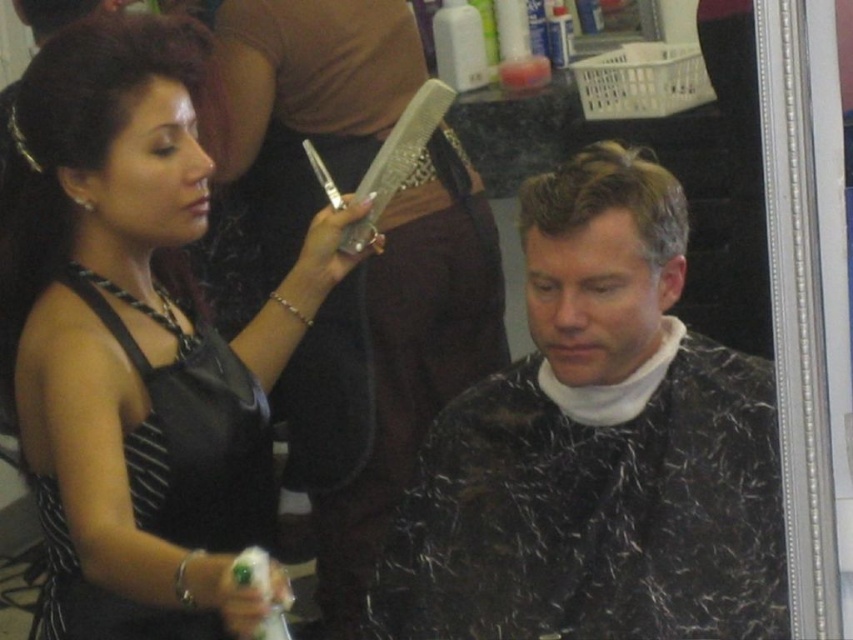
Question: Which of these objects is positioned closest to the shiny black hair at center?

Choices:
 (A) black leather dress at upper left
 (B) slicked matte hair at center
 (C) clear plastic comb at upper center

Answer: (B)

Question: Does slicked matte hair at center have a greater width compared to clear plastic comb at upper center?

Choices:
 (A) no
 (B) yes

Answer: (B)

Question: Which of the following is the closest to the observer?

Choices:
 (A) (598, 148)
 (B) (71, 179)
 (C) (370, 176)

Answer: (A)

Question: Observing the image, what is the correct spatial positioning of black leather dress at upper left in reference to clear plastic comb at upper center?

Choices:
 (A) below
 (B) above

Answer: (A)

Question: Which of these objects is positioned closest to the shiny black hair at center?

Choices:
 (A) slicked matte hair at center
 (B) black leather dress at upper left

Answer: (A)

Question: Can you confirm if black leather dress at upper left is positioned below shiny black hair at center?

Choices:
 (A) yes
 (B) no

Answer: (B)